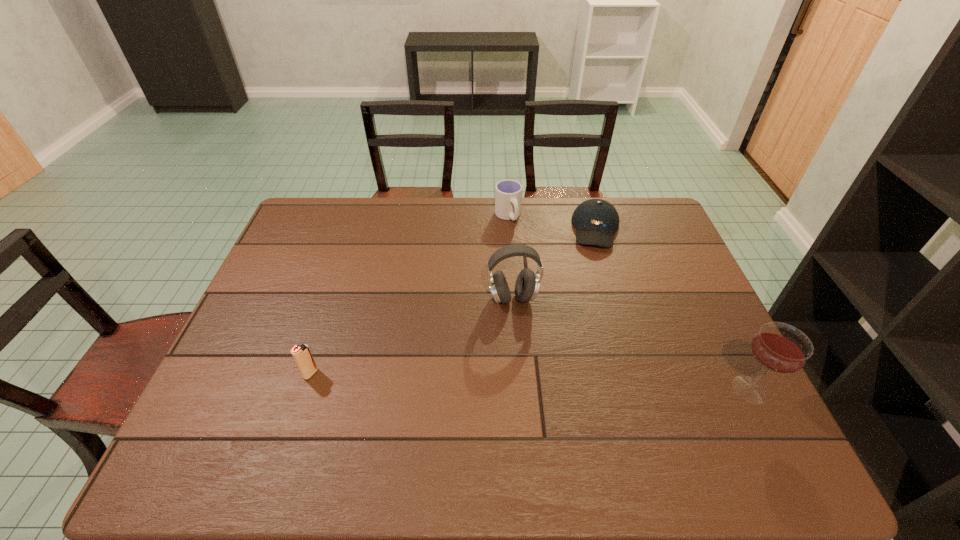
Identify the location of object that is at the right edge. (778, 347).

Where is `object that is at the near right corner`? This screenshot has height=540, width=960. object that is at the near right corner is located at coordinates (778, 347).

The image size is (960, 540). In order to click on free region at the far edge of the desktop in this screenshot , I will do `click(440, 223)`.

The width and height of the screenshot is (960, 540). I want to click on vacant position at the near edge of the desktop, so click(x=328, y=403).

In the image, there is a desktop. Where is `vacant space at the left edge`? The image size is (960, 540). vacant space at the left edge is located at coordinates (246, 367).

What are the coordinates of `blank space at the far left corner of the desktop` in the screenshot? It's located at (335, 215).

At what (x,y) coordinates should I click in order to perform the action: click on free spot between the wineglass and the second object from right to left. Please return your answer as a coordinate pair (x, y). Image resolution: width=960 pixels, height=540 pixels. Looking at the image, I should click on (673, 309).

Locate an element on the screen. vacant area that lies between the wineglass and the headset is located at coordinates (631, 344).

At what (x,y) coordinates should I click in order to perform the action: click on free space that is in between the rightmost object and the cup. Please return your answer as a coordinate pair (x, y). The height and width of the screenshot is (540, 960). Looking at the image, I should click on (629, 303).

You are a GUI agent. You are given a task and a screenshot of the screen. Output one action in this format:
    pyautogui.click(x=<x>, y=<y>)
    Task: Click on the free space between the igniter and the headset
    
    Given the screenshot: What is the action you would take?
    pyautogui.click(x=412, y=336)